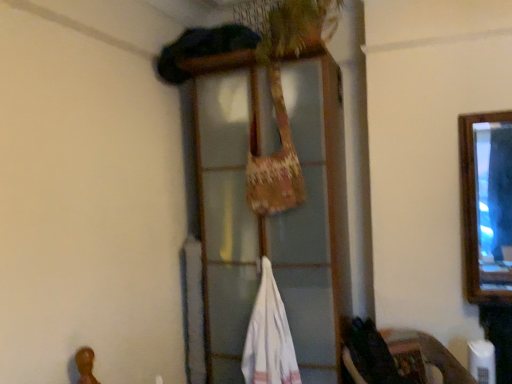
At what (x,y) coordinates should I click in order to perform the action: click on white cotton towel at center. Please return your answer as a coordinate pair (x, y). The height and width of the screenshot is (384, 512). Looking at the image, I should click on click(x=269, y=337).

Measure the distance between point (267, 359) and camera.

The depth of point (267, 359) is 7.56 feet.

The height and width of the screenshot is (384, 512). Describe the element at coordinates (269, 337) in the screenshot. I see `white cotton towel at center` at that location.

Locate an element on the screen. wooden frame at center is located at coordinates pyautogui.click(x=269, y=216).

What do you see at coordinates (269, 216) in the screenshot?
I see `wooden frame at center` at bounding box center [269, 216].

Identify the location of white cotton towel at center. This screenshot has height=384, width=512. [269, 337].

Considering the relative positions of wooden frame at center and white cotton towel at center in the image provided, is wooden frame at center to the left or to the right of white cotton towel at center?

wooden frame at center is to the right of white cotton towel at center.

Is the position of wooden frame at center less distant than that of white cotton towel at center?

That is True.

Which is behind, point (226, 139) or point (254, 368)?

The point (226, 139) is more distant.

From the image's perspective, which one is positioned lower, wooden frame at center or white cotton towel at center?

From the image's view, white cotton towel at center is below.

From a real-world perspective, is wooden frame at center beneath white cotton towel at center?

No, from a real-world perspective, wooden frame at center is not beneath white cotton towel at center.

Considering the relative sizes of wooden frame at center and white cotton towel at center in the image provided, is wooden frame at center wider than white cotton towel at center?

Correct, the width of wooden frame at center exceeds that of white cotton towel at center.

Considering the sizes of objects wooden frame at center and white cotton towel at center in the image provided, who is taller, wooden frame at center or white cotton towel at center?

wooden frame at center is taller.

Who is smaller, wooden frame at center or white cotton towel at center?

white cotton towel at center is smaller.

Is wooden frame at center inside or outside of white cotton towel at center?

wooden frame at center is spatially situated outside white cotton towel at center.

Based on the photo, would you consider wooden frame at center to be distant from white cotton towel at center?

No, wooden frame at center is not far from white cotton towel at center.

Is wooden frame at center facing away from white cotton towel at center?

Yes, wooden frame at center's orientation is away from white cotton towel at center.

How different are the orientations of wooden frame at center and white cotton towel at center in degrees?

The angle between the facing direction of wooden frame at center and the facing direction of white cotton towel at center is 1.94 degrees.

Image resolution: width=512 pixels, height=384 pixels. I want to click on window frame on the right side of white cotton towel at center, so click(x=269, y=216).

Is white cotton towel at center to the left or to the right of wooden frame at center in the image?

Clearly, white cotton towel at center is on the left of wooden frame at center in the image.

Is white cotton towel at center closer to the viewer compared to wooden frame at center?

No, it is behind wooden frame at center.

Considering the positions of points (246, 345) and (206, 308), is point (246, 345) farther from camera compared to point (206, 308)?

That is False.

From the image's perspective, which one is positioned lower, white cotton towel at center or wooden frame at center?

white cotton towel at center, from the image's perspective.

From a real-world perspective, between white cotton towel at center and wooden frame at center, who is vertically lower?

white cotton towel at center.

From the picture: Considering the relative sizes of white cotton towel at center and wooden frame at center in the image provided, is white cotton towel at center wider than wooden frame at center?

Incorrect, the width of white cotton towel at center does not surpass that of wooden frame at center.

Can you confirm if white cotton towel at center is taller than wooden frame at center?

No.

Consider the image. Is white cotton towel at center bigger or smaller than wooden frame at center?

Considering their sizes, white cotton towel at center takes up less space than wooden frame at center.

Is wooden frame at center located within white cotton towel at center?

No, wooden frame at center is not a part of white cotton towel at center.

Are white cotton towel at center and wooden frame at center far apart?

They are positioned close to each other.

Could you tell me if white cotton towel at center is facing wooden frame at center?

Yes.

In order to click on window frame above the white cotton towel at center (from the image's perspective) in this screenshot , I will do `click(269, 216)`.

In the image, there is a wooden frame at center. What are the coordinates of `wide below it (from a real-world perspective)` in the screenshot? It's located at (269, 337).

Identify the location of window frame on the right of white cotton towel at center. (269, 216).